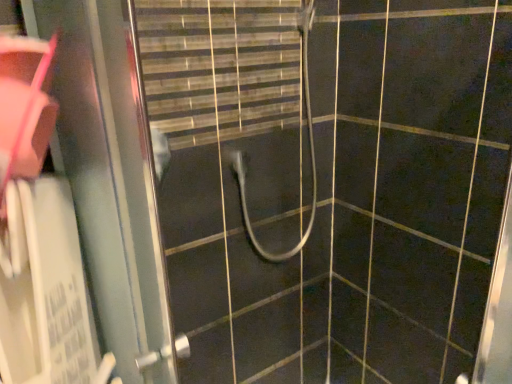
Question: Considering the relative sizes of white rubber hose at center and metallic sliding door at left in the image provided, is white rubber hose at center taller than metallic sliding door at left?

Choices:
 (A) no
 (B) yes

Answer: (A)

Question: Is white rubber hose at center to the right of metallic sliding door at left from the viewer's perspective?

Choices:
 (A) yes
 (B) no

Answer: (A)

Question: Is white rubber hose at center not inside metallic sliding door at left?

Choices:
 (A) yes
 (B) no

Answer: (A)

Question: Does white rubber hose at center have a smaller size compared to metallic sliding door at left?

Choices:
 (A) no
 (B) yes

Answer: (A)

Question: From a real-world perspective, does white rubber hose at center sit lower than metallic sliding door at left?

Choices:
 (A) yes
 (B) no

Answer: (B)

Question: Can you confirm if white rubber hose at center is positioned to the left of metallic sliding door at left?

Choices:
 (A) yes
 (B) no

Answer: (B)

Question: Considering the relative sizes of metallic sliding door at left and white rubber hose at center in the image provided, is metallic sliding door at left smaller than white rubber hose at center?

Choices:
 (A) yes
 (B) no

Answer: (A)

Question: Is metallic sliding door at left oriented towards white rubber hose at center?

Choices:
 (A) yes
 (B) no

Answer: (B)

Question: From the image's perspective, is metallic sliding door at left located above white rubber hose at center?

Choices:
 (A) yes
 (B) no

Answer: (B)

Question: Can you confirm if metallic sliding door at left is taller than white rubber hose at center?

Choices:
 (A) no
 (B) yes

Answer: (B)

Question: Is metallic sliding door at left facing away from white rubber hose at center?

Choices:
 (A) no
 (B) yes

Answer: (B)

Question: Is white rubber hose at center surrounded by metallic sliding door at left?

Choices:
 (A) no
 (B) yes

Answer: (A)

Question: Do you think white rubber hose at center is within metallic sliding door at left, or outside of it?

Choices:
 (A) outside
 (B) inside

Answer: (A)